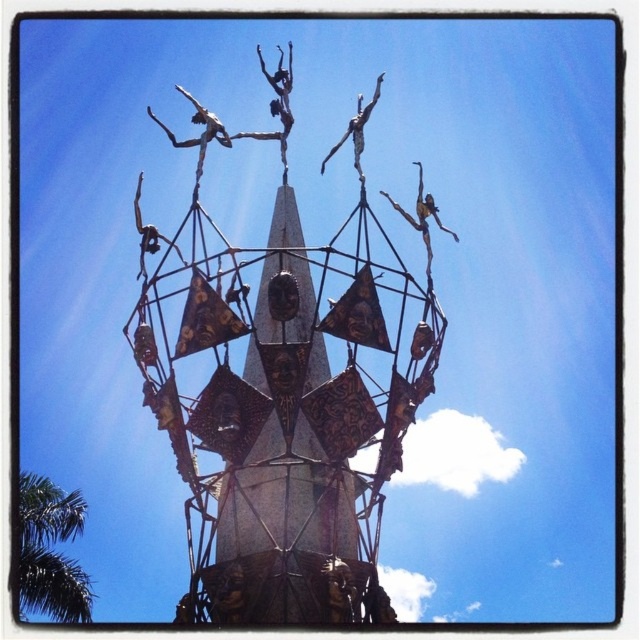
Question: Is green leafy tree at lower left behind polished bronze dancers at upper center?

Choices:
 (A) yes
 (B) no

Answer: (A)

Question: Where is green leafy tree at lower left located in relation to polished bronze dancers at upper center in the image?

Choices:
 (A) below
 (B) above

Answer: (A)

Question: Considering the relative positions of green leafy tree at lower left and polished bronze dancers at upper center in the image provided, where is green leafy tree at lower left located with respect to polished bronze dancers at upper center?

Choices:
 (A) below
 (B) above

Answer: (A)